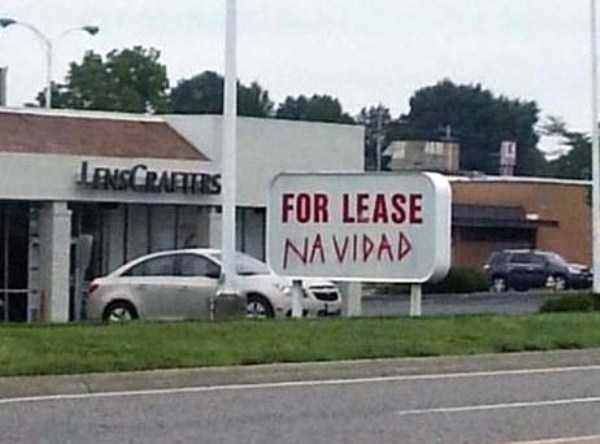
The image size is (600, 444). What are the coordinates of `white columns` in the screenshot? It's located at (49, 256), (212, 230).